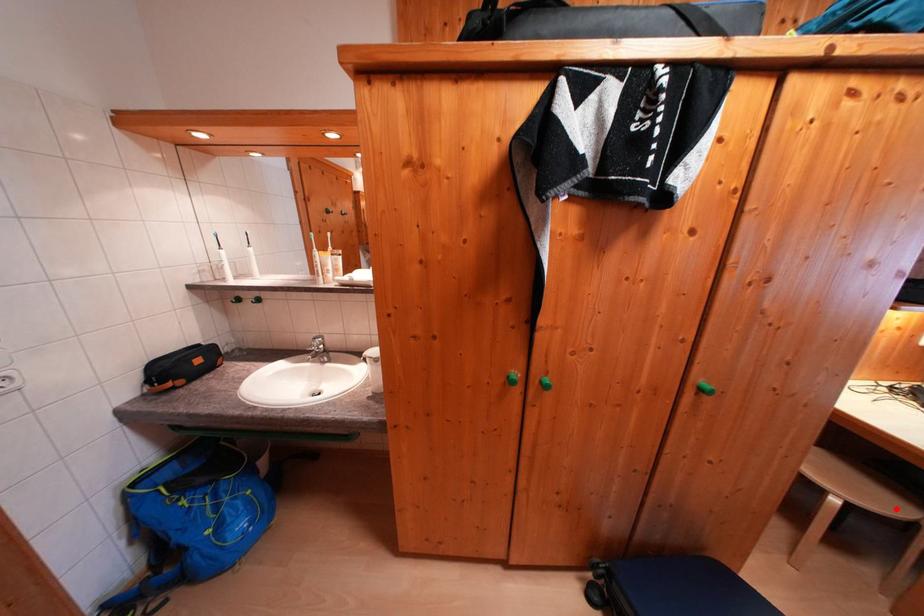
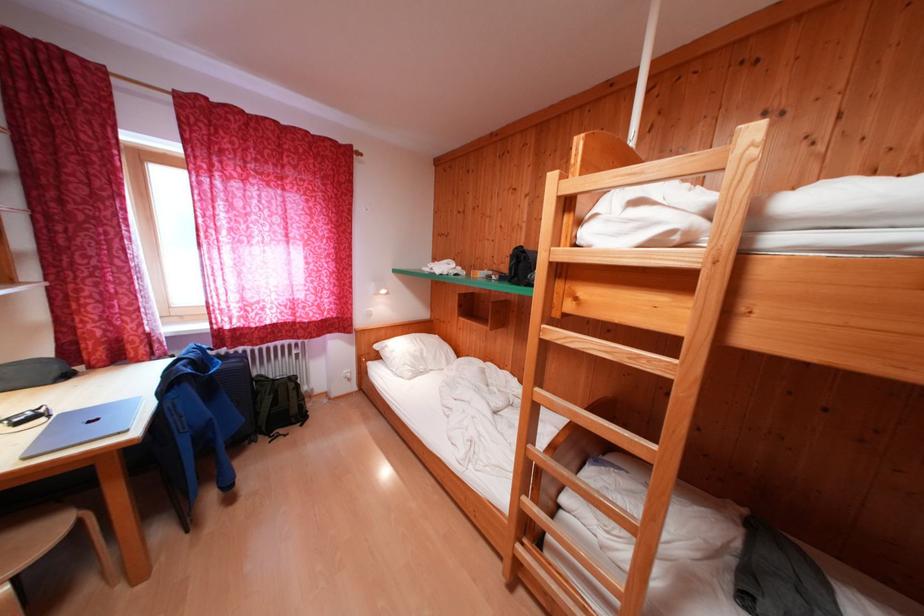
Locate, in the second image, the point that corresponds to the highlighted location in the first image.

(55, 538)